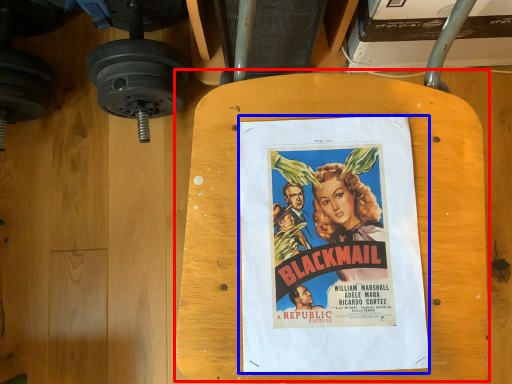
Question: Which object appears closest to the camera in this image, table (highlighted by a red box) or poster (highlighted by a blue box)?

Choices:
 (A) table
 (B) poster

Answer: (A)